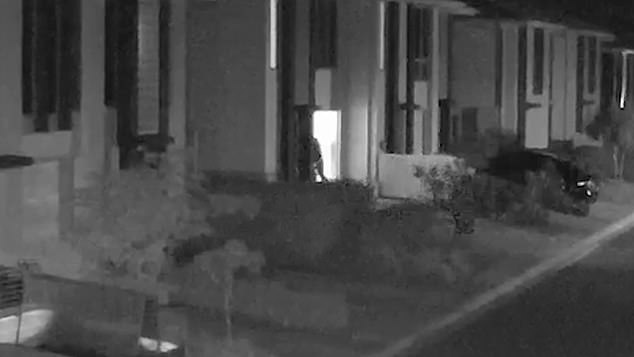
The width and height of the screenshot is (634, 357). I want to click on homes, so click(569, 84), click(481, 83), click(354, 66), click(255, 71), click(15, 111).